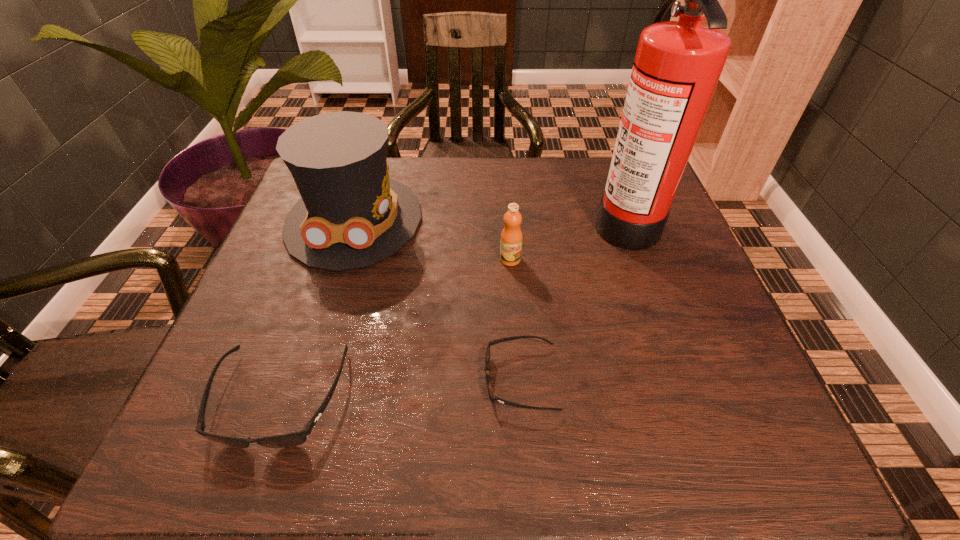
Where is `the left sunglasses`? the left sunglasses is located at coordinates (293, 439).

The width and height of the screenshot is (960, 540). Identify the location of the taller sunglasses. (293, 439).

In order to click on the right sunglasses in this screenshot , I will do `click(487, 356)`.

Locate an element on the screen. the shorter sunglasses is located at coordinates (487, 356).

Locate an element on the screen. The height and width of the screenshot is (540, 960). the second tallest object is located at coordinates (351, 215).

Identify the location of the tallest object. (677, 66).

The height and width of the screenshot is (540, 960). What are the coordinates of `fire extinguisher` in the screenshot? It's located at (677, 66).

I want to click on the third tallest object, so click(x=511, y=237).

Identify the location of vacant region located on the front-facing side of the right sunglasses. Image resolution: width=960 pixels, height=540 pixels. (x=280, y=379).

Find the location of a particular element. vacant space located 0.180m on the front-facing side of the right sunglasses is located at coordinates (379, 379).